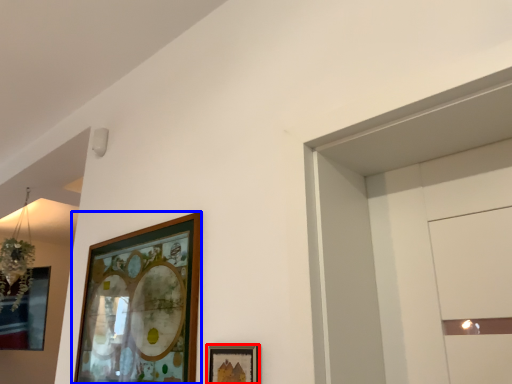
Question: Which point is further to the camera, picture frame (highlighted by a red box) or picture frame (highlighted by a blue box)?

Choices:
 (A) picture frame
 (B) picture frame

Answer: (B)